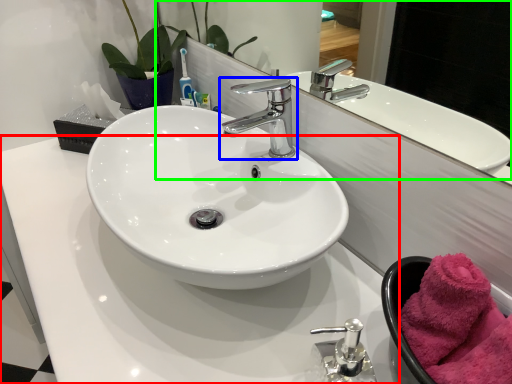
Question: Which is farther away from counter top (highlighted by a red box)? tap (highlighted by a blue box) or mirror (highlighted by a green box)?

Choices:
 (A) tap
 (B) mirror

Answer: (B)